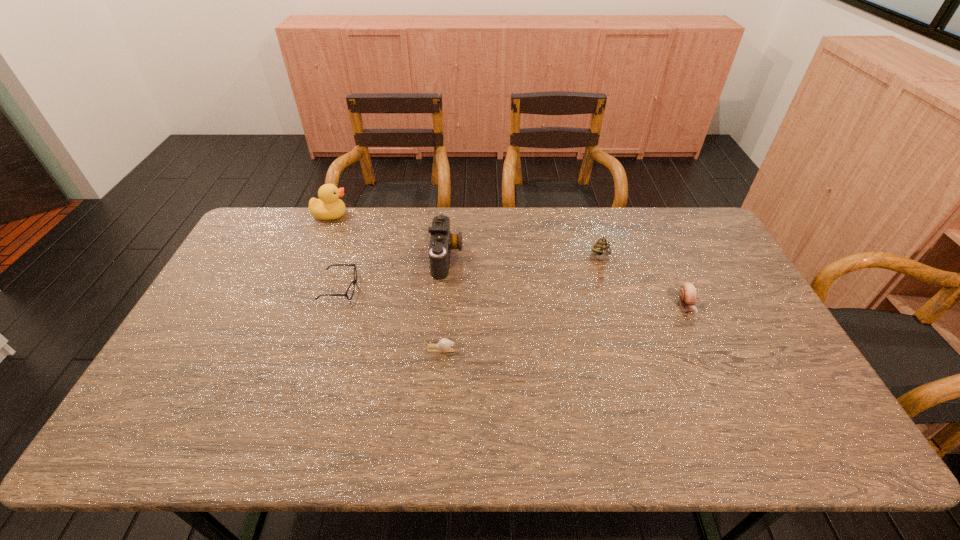
In the image, there is a desktop. Identify the location of vacant space at the left edge. (248, 267).

Locate an element on the screen. This screenshot has height=540, width=960. vacant space at the right edge is located at coordinates (728, 343).

This screenshot has width=960, height=540. In the image, there is a desktop. In order to click on free space at the near left corner in this screenshot , I will do `click(196, 425)`.

Locate an element on the screen. This screenshot has height=540, width=960. vacant space at the far right corner of the desktop is located at coordinates click(709, 244).

Where is `vacant space at the near right corner`? This screenshot has width=960, height=540. vacant space at the near right corner is located at coordinates (805, 423).

The image size is (960, 540). What are the coordinates of `vacant area between the tallest escargot and the leftmost escargot` in the screenshot? It's located at (521, 304).

This screenshot has height=540, width=960. I want to click on free space that is in between the rightmost escargot and the duck, so click(509, 260).

Where is `free space between the nearest object and the duck`? free space between the nearest object and the duck is located at coordinates (385, 282).

Image resolution: width=960 pixels, height=540 pixels. I want to click on vacant area that lies between the fifth tallest object and the third shortest object, so click(514, 298).

Find the location of a particular element. Image resolution: width=960 pixels, height=540 pixels. empty space that is in between the spectacles and the tallest escargot is located at coordinates (471, 274).